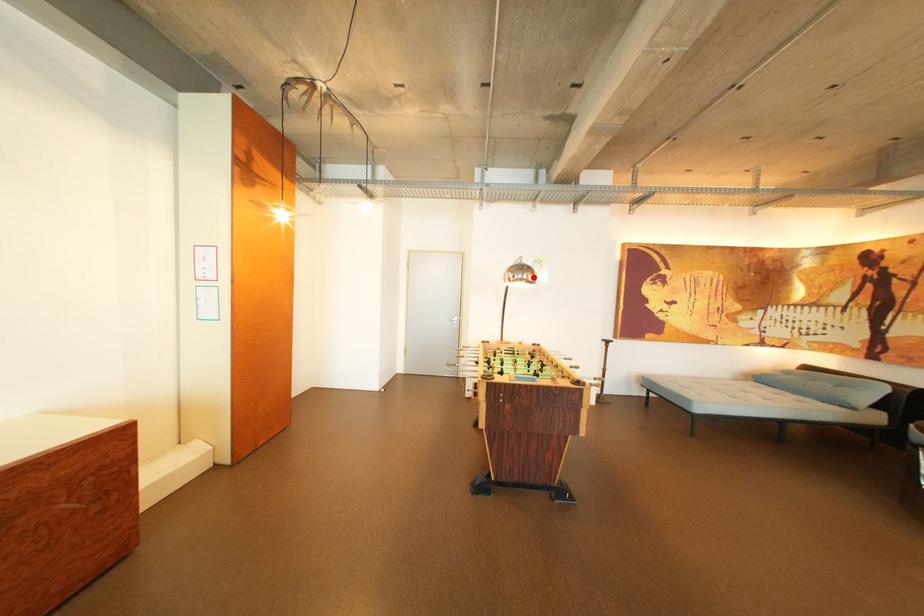
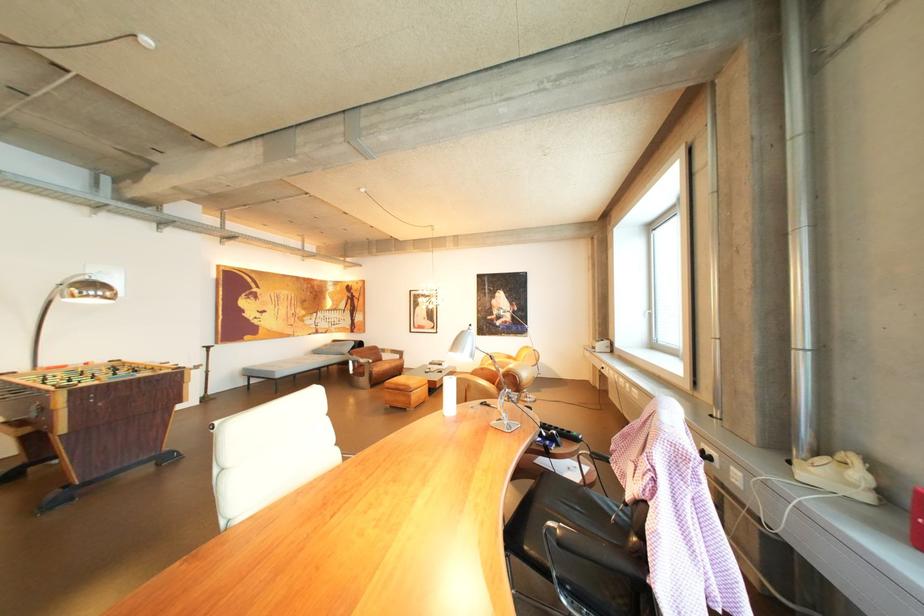
Locate, in the second image, the point that corresponds to the highlighted location in the first image.

(105, 294)